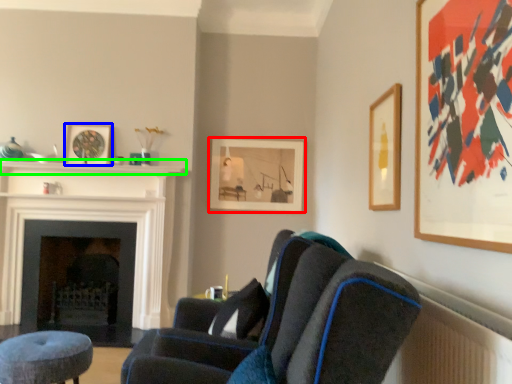
Question: Based on their relative distances, which object is farther from picture frame (highlighted by a red box)? Choose from picture frame (highlighted by a blue box) and balustrade (highlighted by a green box).

Choices:
 (A) picture frame
 (B) balustrade

Answer: (A)